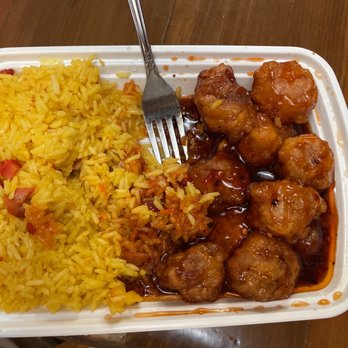
Where is `fork`? The image size is (348, 348). fork is located at coordinates (154, 88).